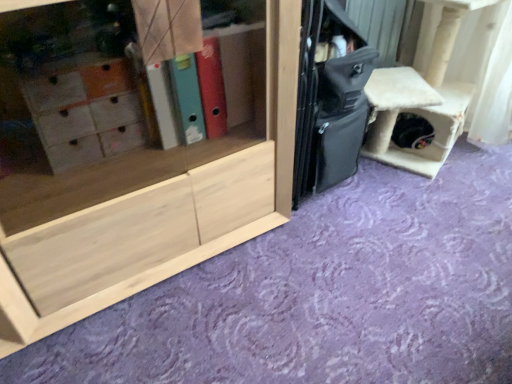
Identify the location of free space in front of white fluffy cat house at right. The width and height of the screenshot is (512, 384). point(423,214).